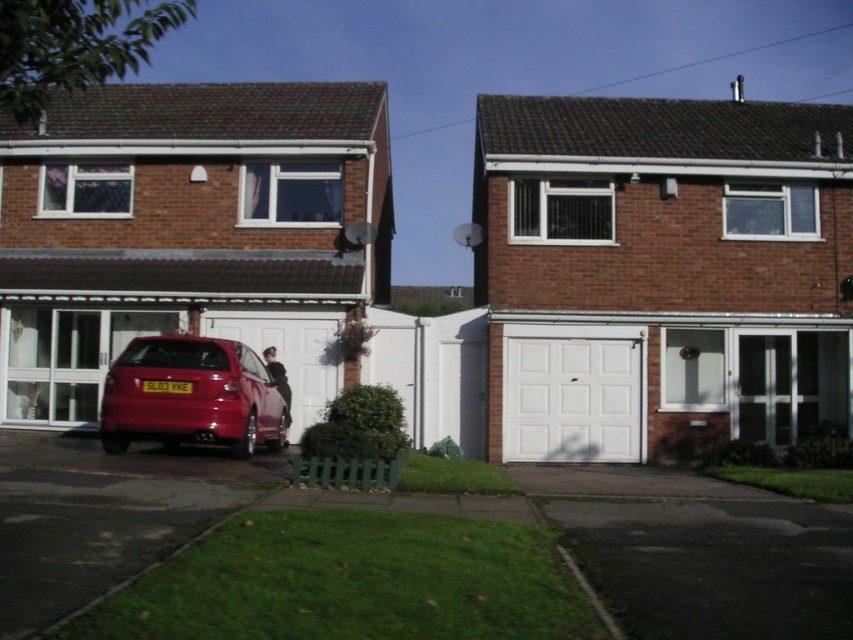
Question: Can you confirm if white matte garage door at center is positioned above glossy red car at lower left?

Choices:
 (A) yes
 (B) no

Answer: (A)

Question: Which object is closer to the camera taking this photo?

Choices:
 (A) glossy red car at lower left
 (B) white matte garage door at center

Answer: (A)

Question: Does white matte garage door at center have a larger size compared to glossy red car at lower left?

Choices:
 (A) yes
 (B) no

Answer: (A)

Question: Can you confirm if white matte garage door at center is wider than glossy red car at lower left?

Choices:
 (A) no
 (B) yes

Answer: (B)